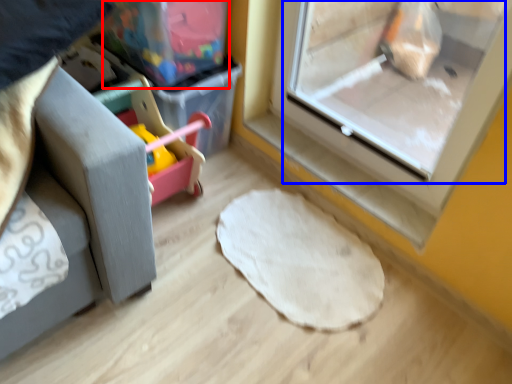
Question: Among these objects, which one is farthest to the camera, storage box (highlighted by a red box) or screen door (highlighted by a blue box)?

Choices:
 (A) storage box
 (B) screen door

Answer: (A)